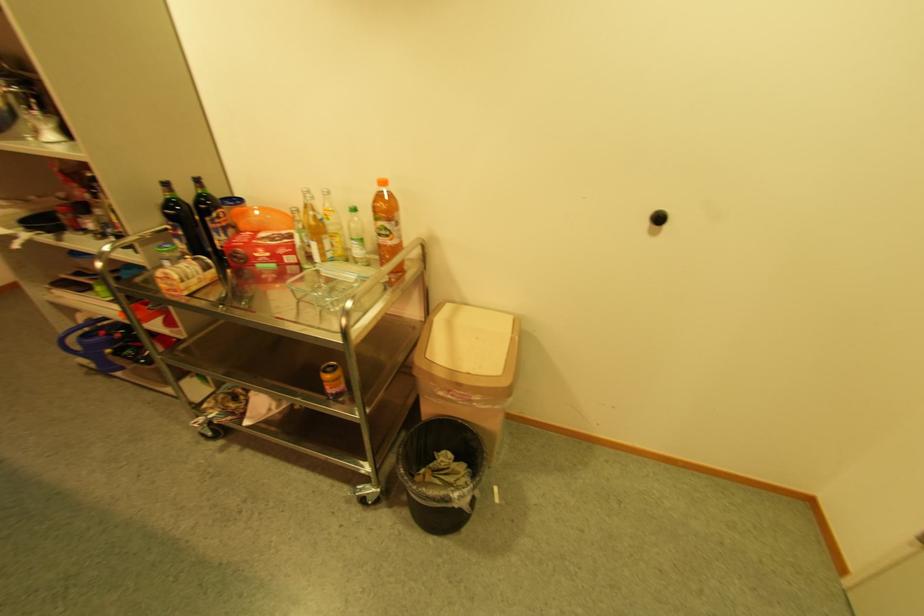
The image size is (924, 616). What do you see at coordinates (79, 329) in the screenshot?
I see `the blue bucket handle` at bounding box center [79, 329].